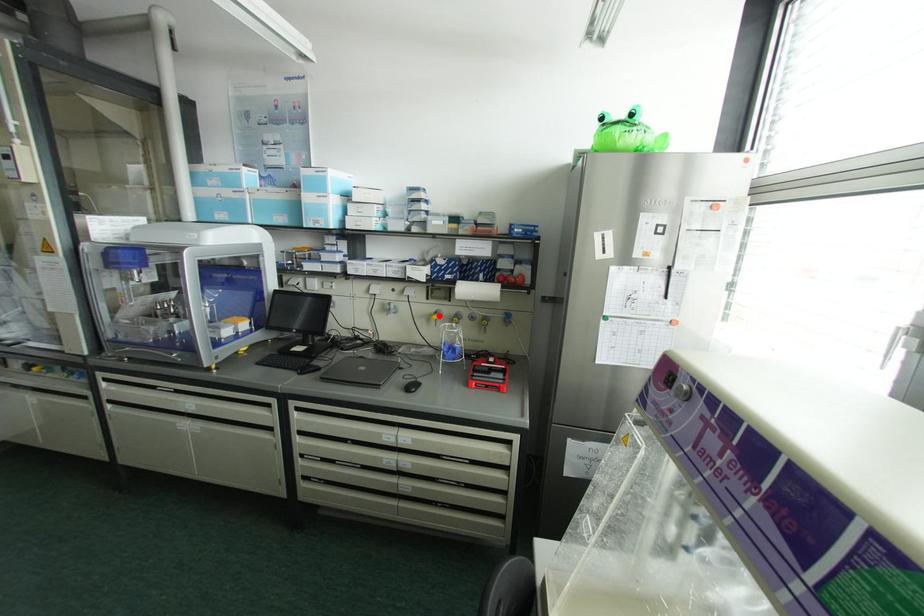
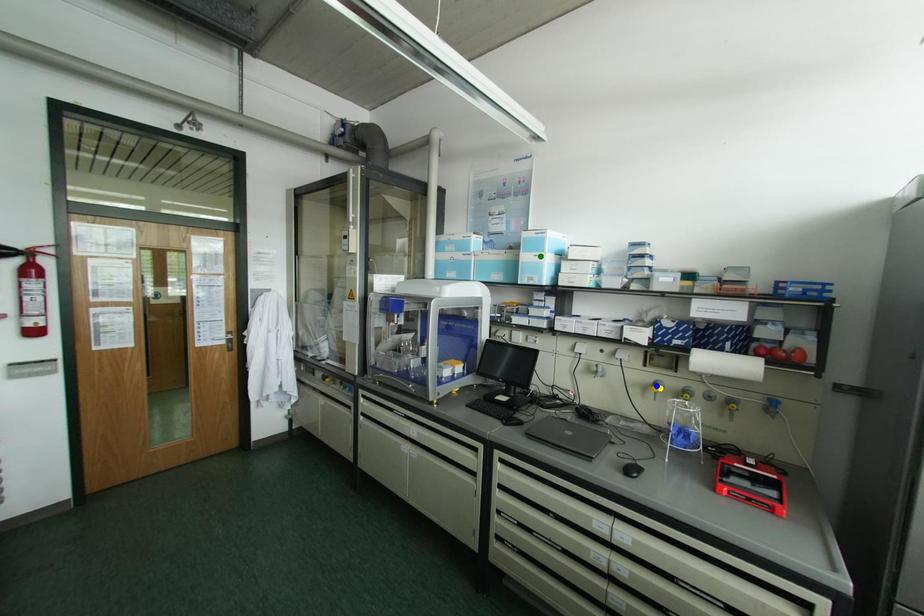
Question: I am providing you with two images of the same scene from different viewpoints. A red point is marked on the first image. You are given multiple points on the second image. Which spot in image 2 lines up with the point in image 1?

Choices:
 (A) yellow point
 (B) blue point
 (C) green point

Answer: (A)